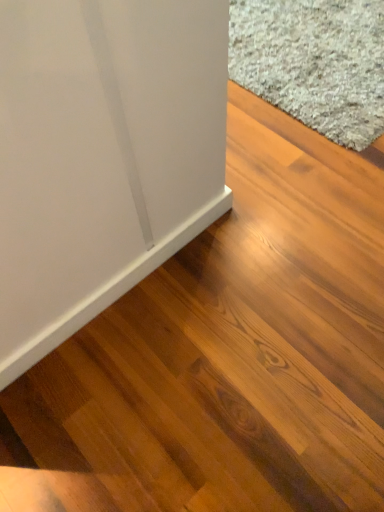
Question: From the image's perspective, is white matte baseboard at lower left on gray shaggy carpet at upper right?

Choices:
 (A) yes
 (B) no

Answer: (B)

Question: Does white matte baseboard at lower left appear on the right side of gray shaggy carpet at upper right?

Choices:
 (A) yes
 (B) no

Answer: (B)

Question: Does white matte baseboard at lower left lie behind gray shaggy carpet at upper right?

Choices:
 (A) yes
 (B) no

Answer: (B)

Question: Is white matte baseboard at lower left placed right next to gray shaggy carpet at upper right?

Choices:
 (A) yes
 (B) no

Answer: (B)

Question: Can you confirm if white matte baseboard at lower left is wider than gray shaggy carpet at upper right?

Choices:
 (A) no
 (B) yes

Answer: (A)

Question: Is white matte baseboard at lower left positioned with its back to gray shaggy carpet at upper right?

Choices:
 (A) yes
 (B) no

Answer: (B)

Question: Is the depth of gray shaggy carpet at upper right less than that of white matte baseboard at lower left?

Choices:
 (A) yes
 (B) no

Answer: (B)

Question: Does gray shaggy carpet at upper right have a lesser height compared to white matte baseboard at lower left?

Choices:
 (A) no
 (B) yes

Answer: (B)

Question: Considering the relative sizes of gray shaggy carpet at upper right and white matte baseboard at lower left in the image provided, is gray shaggy carpet at upper right smaller than white matte baseboard at lower left?

Choices:
 (A) no
 (B) yes

Answer: (A)

Question: Can you confirm if gray shaggy carpet at upper right is wider than white matte baseboard at lower left?

Choices:
 (A) no
 (B) yes

Answer: (B)

Question: From a real-world perspective, is gray shaggy carpet at upper right physically above white matte baseboard at lower left?

Choices:
 (A) yes
 (B) no

Answer: (B)

Question: From the image's perspective, is gray shaggy carpet at upper right below white matte baseboard at lower left?

Choices:
 (A) yes
 (B) no

Answer: (B)

Question: Considering the relative positions of white matte baseboard at lower left and gray shaggy carpet at upper right in the image provided, is white matte baseboard at lower left to the left or to the right of gray shaggy carpet at upper right?

Choices:
 (A) left
 (B) right

Answer: (A)